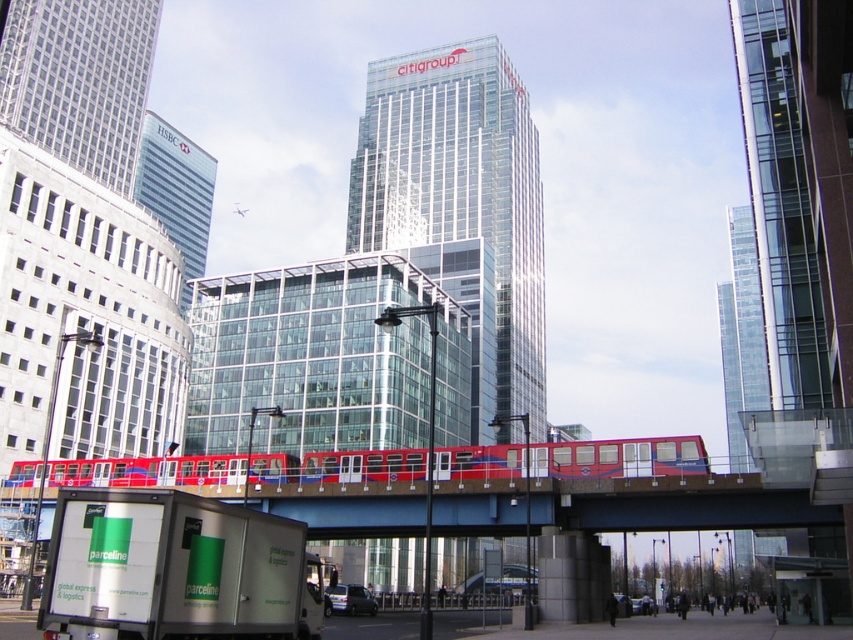
Question: Which point is farther to the camera?

Choices:
 (A) (352, 472)
 (B) (137, 502)

Answer: (A)

Question: Is white matte truck at lower left smaller than red metallic train at center?

Choices:
 (A) no
 (B) yes

Answer: (B)

Question: Which of the following is the closest to the observer?

Choices:
 (A) (701, 458)
 (B) (115, 616)

Answer: (B)

Question: Does white matte truck at lower left appear under red metallic train at center?

Choices:
 (A) yes
 (B) no

Answer: (B)

Question: Is white matte truck at lower left above red metallic train at center?

Choices:
 (A) no
 (B) yes

Answer: (B)